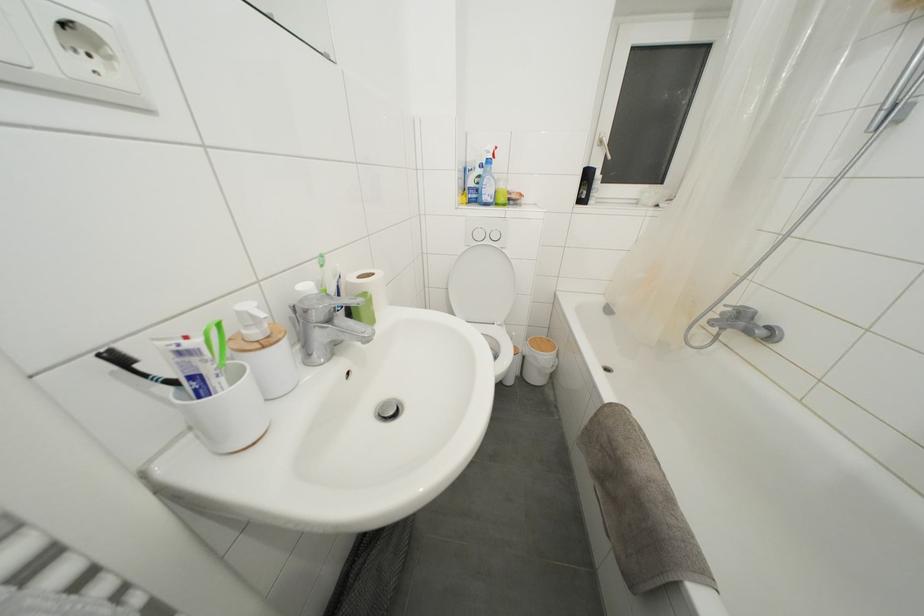
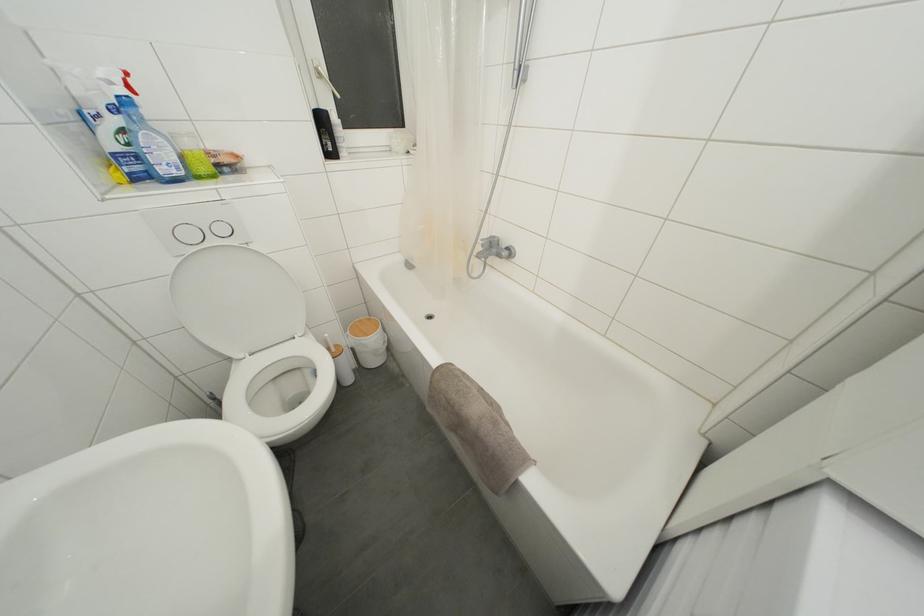
In the second image, find the point that corresponds to (x=544, y=342) in the first image.

(363, 326)